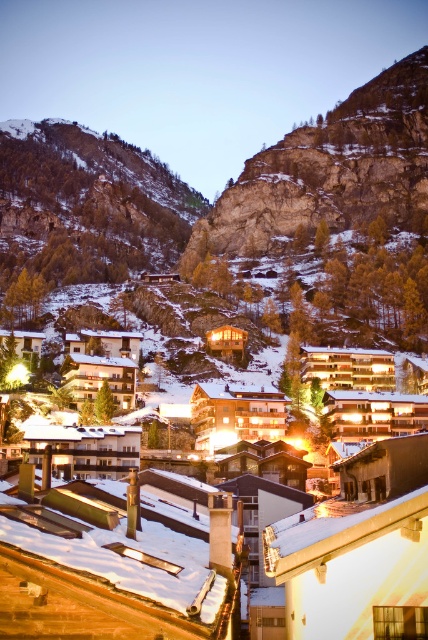
You are standing in the alpine village and want to take a photo of the snowy rocky cliff at upper left. What are the coordinates where you should aim your camera?

The snowy rocky cliff at upper left is located at coordinates point [86,205].

You are a hiker planning to cross the gap between the snowy rocky cliff at upper left and the rocky cliff at upper center. Your backpack has a rope that can stretch up to 60 meters. Based on the scene, will the rope be sufficient to safely cross the gap?

The distance between the snowy rocky cliff at upper left and the rocky cliff at upper center is 63.58 meters. Since the rope can only stretch up to 60 meters, it will not be sufficient to safely cross the gap.